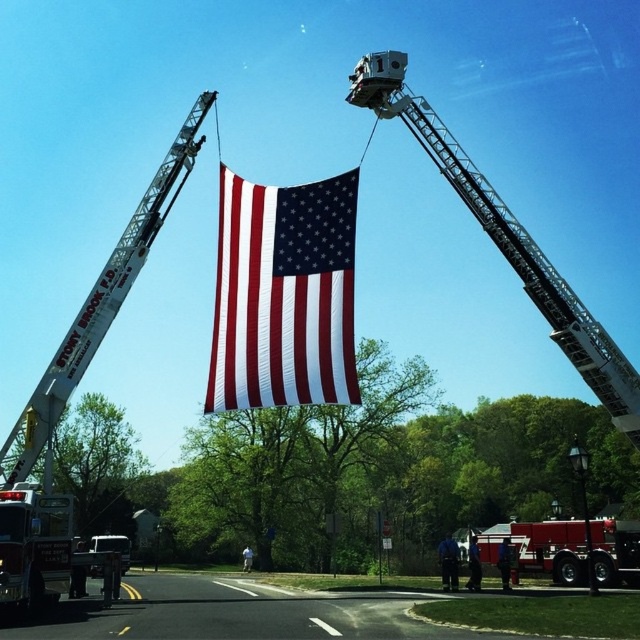
Question: In this image, where is red glossy fire truck at center located relative to metallic silver lift at center?

Choices:
 (A) right
 (B) left

Answer: (A)

Question: Can you confirm if white metallic fire truck at left is positioned to the right of metallic silver lift at center?

Choices:
 (A) no
 (B) yes

Answer: (B)

Question: Which point is closer to the camera?

Choices:
 (A) (320, 227)
 (B) (573, 456)
 (C) (465, 173)
 (D) (520, 528)

Answer: (B)

Question: In this image, where is matte fabric flag at center located relative to red glossy fire truck at center?

Choices:
 (A) below
 (B) above

Answer: (B)

Question: Which of the following is the closest to the observer?

Choices:
 (A) (109, 547)
 (B) (584, 502)
 (C) (620, 561)

Answer: (C)

Question: Which object is farther from the camera taking this photo?

Choices:
 (A) matte fabric flag at center
 (B) metallic silver ladder at upper center
 (C) green painted metal streetlight at lower right
 (D) red glossy fire truck at center

Answer: (B)